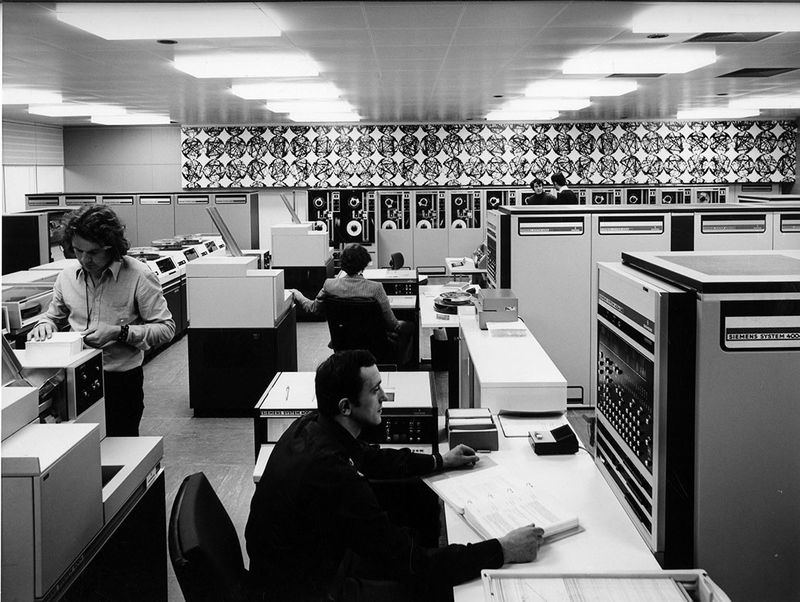
Where is `rows of lights`? rows of lights is located at coordinates (269, 69), (634, 59), (776, 102), (34, 96).